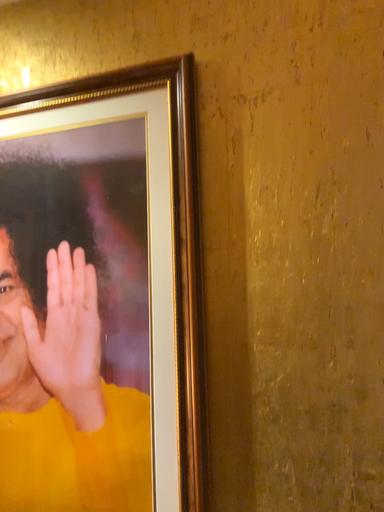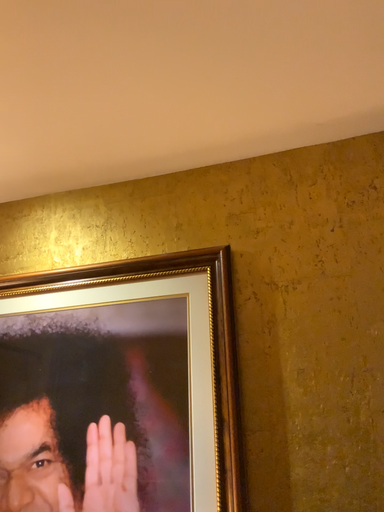
Question: Which way did the camera rotate in the video?

Choices:
 (A) rotated upward
 (B) rotated downward

Answer: (A)